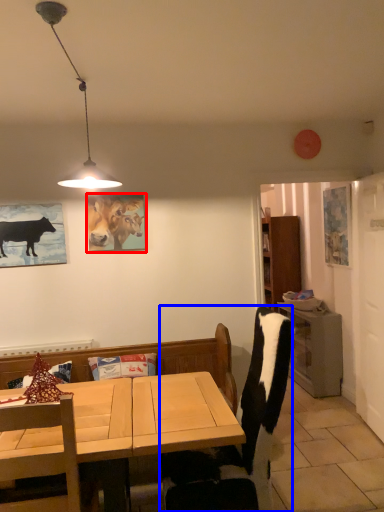
Question: Among these objects, which one is nearest to the camera, picture frame (highlighted by a red box) or chair (highlighted by a blue box)?

Choices:
 (A) picture frame
 (B) chair

Answer: (B)